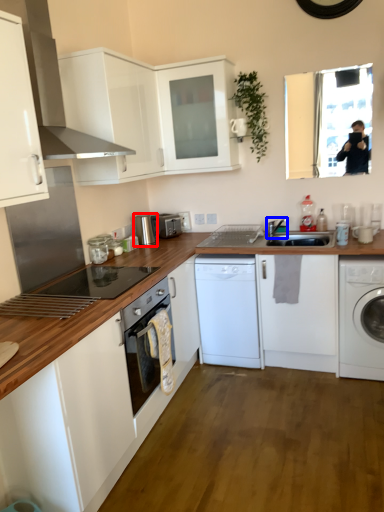
Question: Which of the following is the farthest to the observer, kitchen appliance (highlighted by a red box) or tap (highlighted by a blue box)?

Choices:
 (A) kitchen appliance
 (B) tap

Answer: (A)